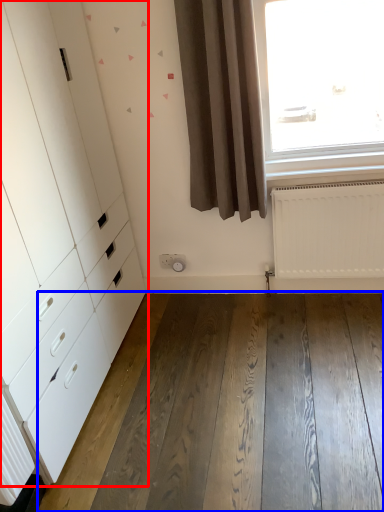
Question: Among these objects, which one is nearest to the camera, chest of drawers (highlighted by a red box) or hardwood (highlighted by a blue box)?

Choices:
 (A) chest of drawers
 (B) hardwood

Answer: (A)